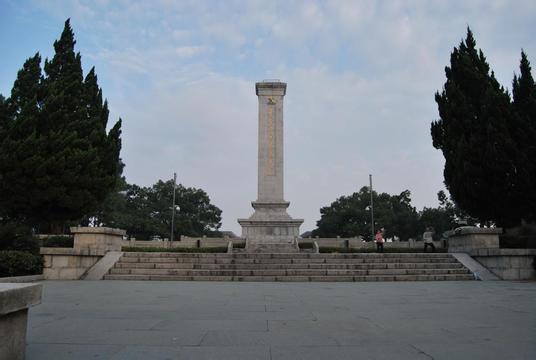
Where is `pillar`? This screenshot has width=536, height=360. pillar is located at coordinates (279, 159).